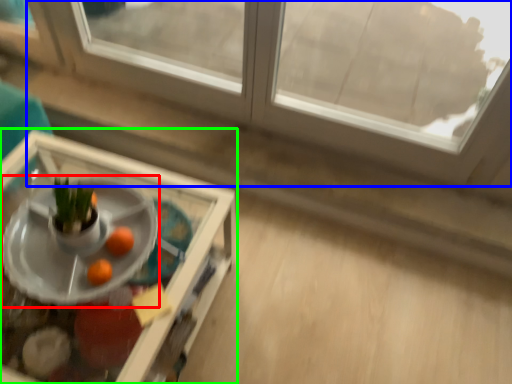
Question: Based on their relative distances, which object is farther from table (highlighted by a red box)? Choose from window (highlighted by a blue box) and table (highlighted by a green box).

Choices:
 (A) window
 (B) table

Answer: (A)